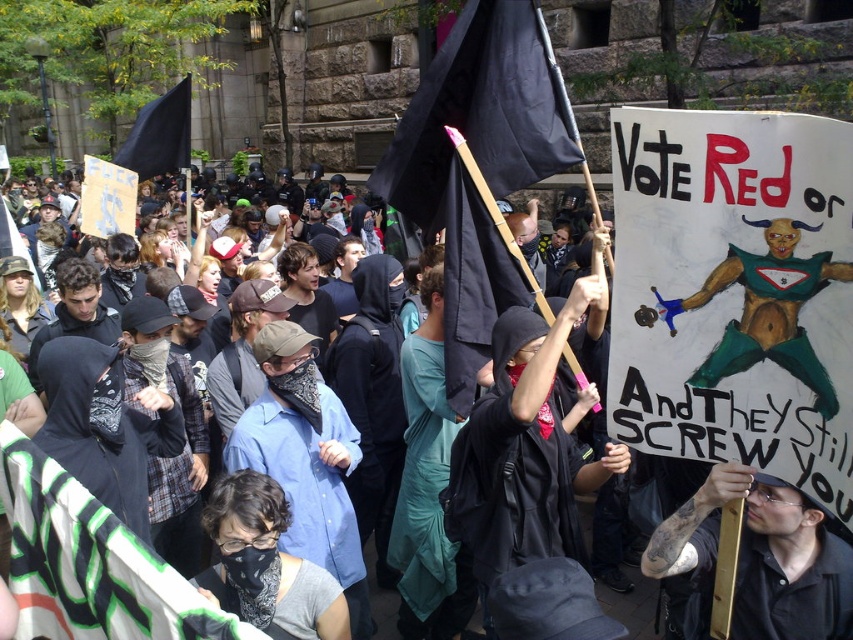
You are a photographer trying to capture the protest scene. You notice the black leather jacket at center and the black fabric flag at upper left. Which object would require a wider angle lens to capture its full width in your photo?

The black fabric flag at upper left requires a wider angle lens because its width is greater than the black leather jacket at center.

You are a photographer standing at the edge of the protest crowd. You want to capture a photo of the black leather jacket at center and the black fabric flag at upper left in the same frame. The camera you have can only focus on objects within a 10 meter range. Will both objects be in focus?

The black leather jacket at center is 12.68 meters from the black fabric flag at upper left. Since the camera can only focus within 10 meters, the distance between them exceeds the focus range, so both objects cannot be in focus simultaneously.